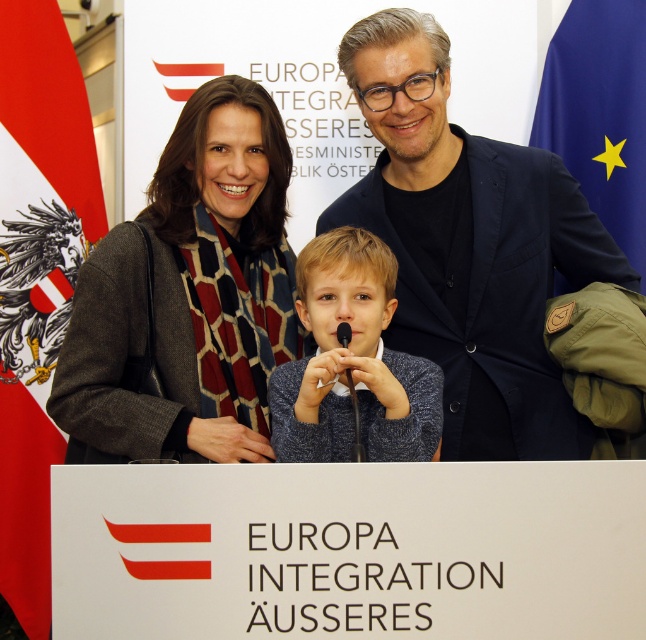
Question: Among these objects, which one is farthest from the camera?

Choices:
 (A) dark gray wool coat at center
 (B) knitted sweater at center
 (C) red-white fabric flag at left

Answer: (C)

Question: Among these points, which one is nearest to the camera?

Choices:
 (A) (138, 339)
 (B) (289, 404)
 (C) (609, 168)

Answer: (B)

Question: Is knitted sweater at center closer to camera compared to blue fabric flag at upper right?

Choices:
 (A) no
 (B) yes

Answer: (B)

Question: Which point is farther to the camera?

Choices:
 (A) (253, 97)
 (B) (360, 253)
 (C) (65, 52)

Answer: (C)

Question: Is red-white fabric flag at left above black matte microphone at center?

Choices:
 (A) yes
 (B) no

Answer: (A)

Question: Does dark blue textured blazer at center have a smaller size compared to knitted sweater at center?

Choices:
 (A) yes
 (B) no

Answer: (B)